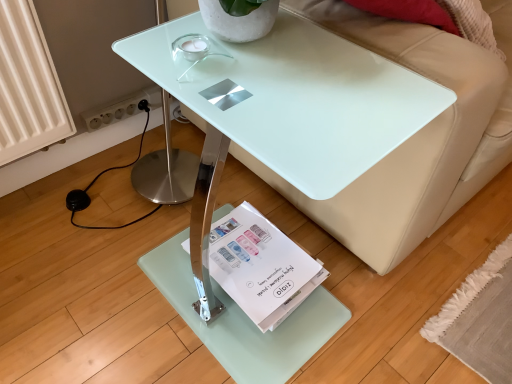
Question: Would you say transparent glass table at center is outside white paper magazine at lower center?

Choices:
 (A) no
 (B) yes

Answer: (B)

Question: From a real-world perspective, is transparent glass table at center positioned under white paper magazine at lower center based on gravity?

Choices:
 (A) no
 (B) yes

Answer: (A)

Question: Considering the relative sizes of transparent glass table at center and white paper magazine at lower center in the image provided, is transparent glass table at center smaller than white paper magazine at lower center?

Choices:
 (A) yes
 (B) no

Answer: (B)

Question: Can you see transparent glass table at center touching white paper magazine at lower center?

Choices:
 (A) no
 (B) yes

Answer: (A)

Question: Is transparent glass table at center to the left of white paper magazine at lower center from the viewer's perspective?

Choices:
 (A) yes
 (B) no

Answer: (B)

Question: Is transparent glass table at center facing towards white paper magazine at lower center?

Choices:
 (A) yes
 (B) no

Answer: (B)

Question: Is white paper magazine at lower center further to the viewer compared to transparent glass table at center?

Choices:
 (A) yes
 (B) no

Answer: (A)

Question: Is white paper magazine at lower center located outside transparent glass table at center?

Choices:
 (A) no
 (B) yes

Answer: (A)

Question: Is white paper magazine at lower center wider than transparent glass table at center?

Choices:
 (A) no
 (B) yes

Answer: (A)

Question: From the image's perspective, is white paper magazine at lower center located above transparent glass table at center?

Choices:
 (A) yes
 (B) no

Answer: (B)

Question: Is white paper magazine at lower center facing towards transparent glass table at center?

Choices:
 (A) no
 (B) yes

Answer: (B)

Question: Is transparent glass table at center completely or partially inside white paper magazine at lower center?

Choices:
 (A) no
 (B) yes

Answer: (A)

Question: Can we say transparent glass table at center lies outside beige leather couch at upper right?

Choices:
 (A) yes
 (B) no

Answer: (A)